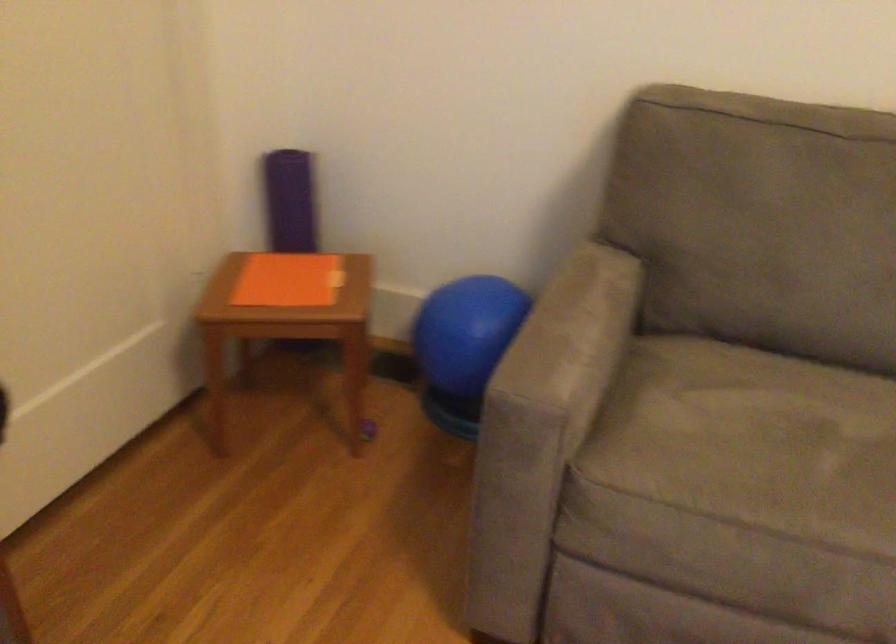
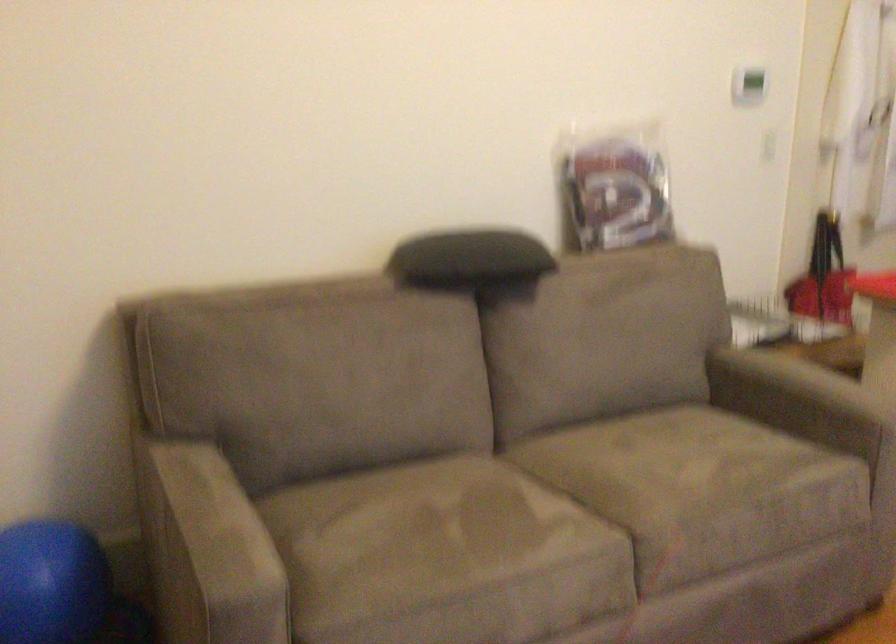
Where in the second image is the point corresponding to [478,333] from the first image?

(49, 583)